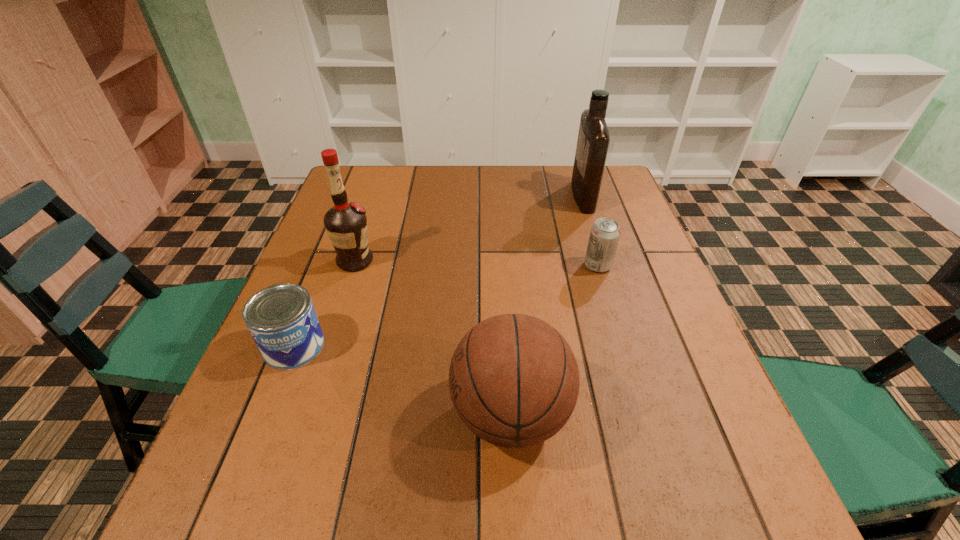
The width and height of the screenshot is (960, 540). I want to click on soda can located in the right edge section of the desktop, so click(605, 232).

The height and width of the screenshot is (540, 960). I want to click on object that is at the far right corner, so click(x=593, y=140).

Identify the location of free space at the far edge of the desktop. (463, 186).

Find the location of a particular element. The width and height of the screenshot is (960, 540). vacant space at the near edge of the desktop is located at coordinates (361, 539).

In the image, there is a desktop. Find the location of `vacant space at the left edge`. vacant space at the left edge is located at coordinates (300, 426).

Where is `vacant space at the right edge of the desktop`? vacant space at the right edge of the desktop is located at coordinates (602, 291).

In the image, there is a desktop. Identify the location of vacant space at the far left corner. The image size is (960, 540). (360, 185).

At what (x,y) coordinates should I click in order to perform the action: click on vacant space at the far right corner of the desktop. Please return your answer as a coordinate pair (x, y). Image resolution: width=960 pixels, height=540 pixels. Looking at the image, I should click on (611, 174).

What are the coordinates of `vacant area at the near right corner` in the screenshot? It's located at (721, 512).

You are a GUI agent. You are given a task and a screenshot of the screen. Output one action in this format:
    pyautogui.click(x=<x>, y=<y>)
    Task: Click on the empty space between the farthest object and the nearer liquor
    
    Given the screenshot: What is the action you would take?
    pyautogui.click(x=468, y=229)